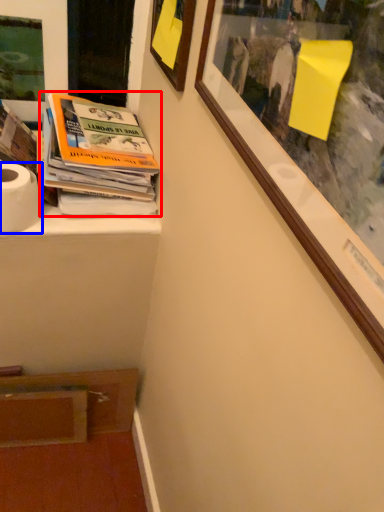
Question: Among these objects, which one is nearest to the camera, book (highlighted by a red box) or toilet paper (highlighted by a blue box)?

Choices:
 (A) book
 (B) toilet paper

Answer: (B)